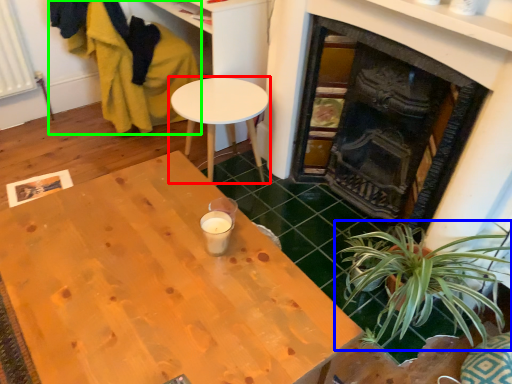
Question: Which object is positioned closest to table (highlighted by a red box)? Select from houseplant (highlighted by a blue box) and swivel chair (highlighted by a green box).

Choices:
 (A) houseplant
 (B) swivel chair

Answer: (B)